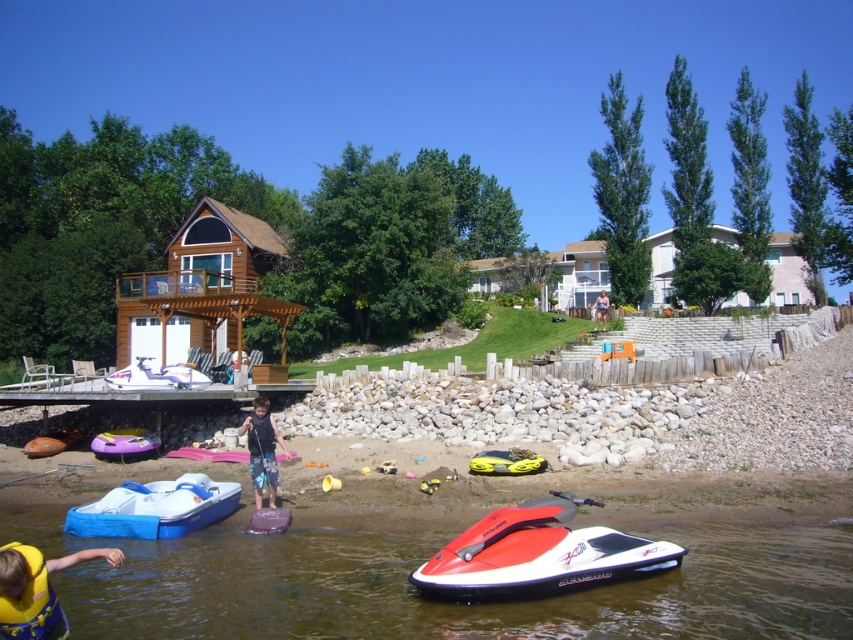
Does rubber/soft inner tube at lower left have a larger size compared to matte purple kayak at lower center?

Yes, rubber/soft inner tube at lower left is bigger than matte purple kayak at lower center.

Does point (97, 444) come in front of point (259, 518)?

No, (97, 444) is behind (259, 518).

Is point (142, 442) behind point (277, 509)?

Yes, it is.

Identify the location of rubber/soft inner tube at lower left. (125, 444).

Which is more to the right, yellow life vest at lower left or matte purple kayak at lower center?

matte purple kayak at lower center is more to the right.

Is point (28, 596) behind point (280, 525)?

No, (28, 596) is closer to viewer.

Who is more distant from viewer, (22, 561) or (283, 529)?

The point (283, 529) is behind.

You are a GUI agent. You are given a task and a screenshot of the screen. Output one action in this format:
    pyautogui.click(x=<x>, y=<y>)
    Task: Click on the yellow life vest at lower left
    
    Given the screenshot: What is the action you would take?
    pyautogui.click(x=36, y=589)

Is the position of smooth water at lower center more distant than that of blue denim shorts at center?

No, it is in front of blue denim shorts at center.

Is point (358, 540) farther from camera compared to point (252, 483)?

No, it is in front of (252, 483).

At what (x,y) coordinates should I click in order to perform the action: click on smooth water at lower center. Please return your answer as a coordinate pair (x, y). Looking at the image, I should click on 434,600.